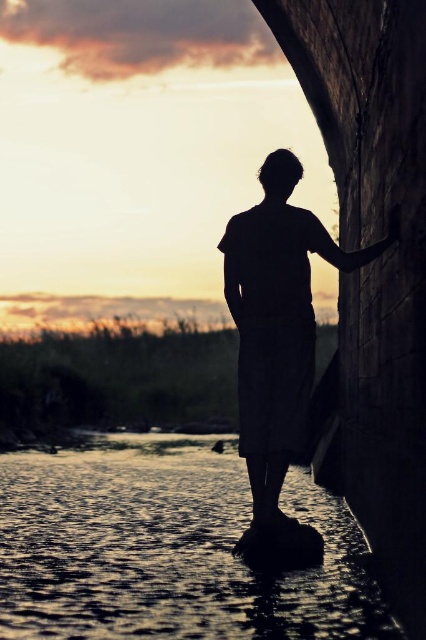
You are an observer at the lakeside. You see the shiny reflective water at lower center and the silhouette fabric at center. Which object is closer to the horizon?

The shiny reflective water at lower center is shorter than the silhouette fabric at center, so the shiny reflective water at lower center is closer to the horizon.

You are a photographer trying to capture the reflection of the sunset in the shiny reflective water at lower center. However, the silhouette fabric at center is blocking your view. Can you move the fabric to the side to get a clear shot of the water?

The shiny reflective water at lower center is in front of the silhouette fabric at center, so moving the silhouette fabric at center would reveal the water behind it, allowing you to capture the reflection.

You are a photographer trying to capture the silhouette fabric at center and the shiny reflective water at lower center in the same frame. Based on their positions, which object should you focus on first to ensure both are in focus?

The silhouette fabric at center is located above the shiny reflective water at lower center, so you should focus on the silhouette fabric at center first to ensure both are in focus.